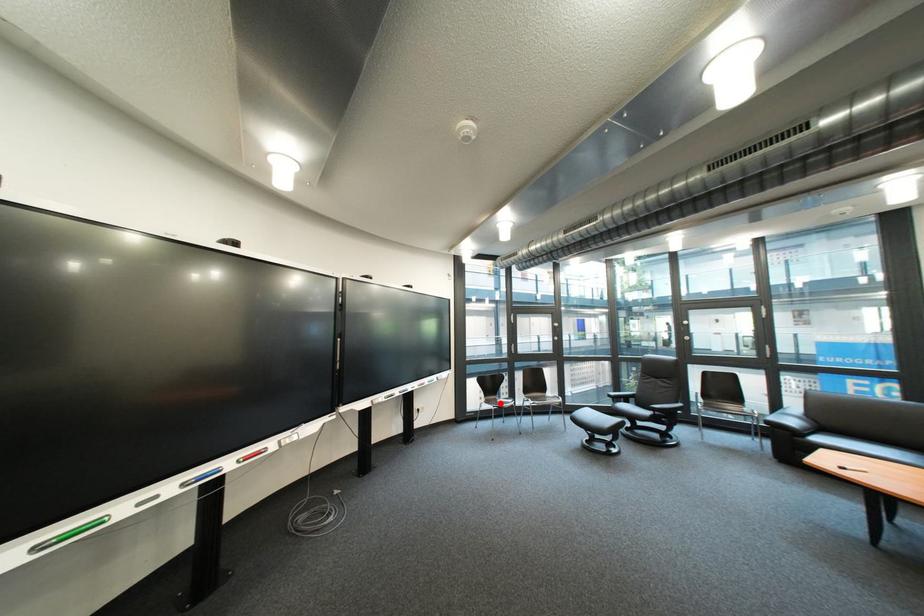
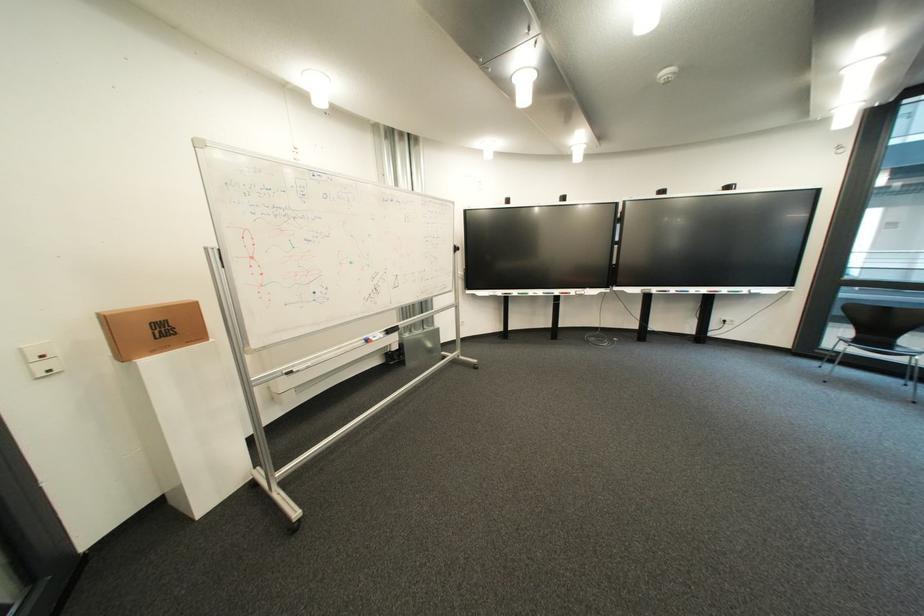
Question: I am providing you with two images of the same scene from different viewpoints. A red point is marked on the first image. Is the red point's position out of view in image 2?

Choices:
 (A) Yes
 (B) No

Answer: (B)